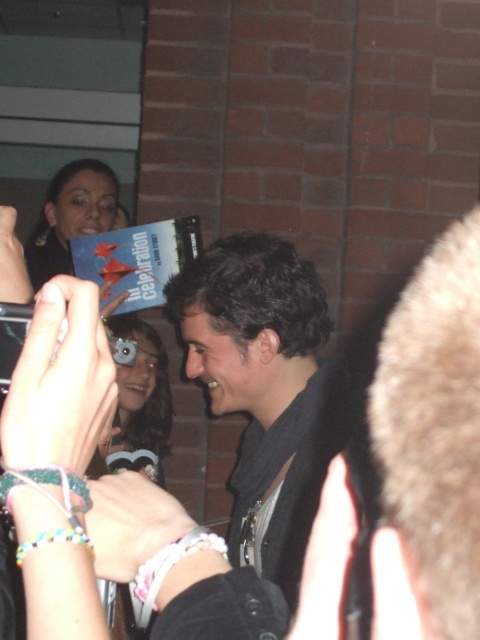
Question: Which point is farther from the camera taking this photo?

Choices:
 (A) (223, 385)
 (B) (82, 163)
 (C) (136, 353)

Answer: (B)

Question: Is matte black book at upper left positioned in front of matte black camera at center?

Choices:
 (A) yes
 (B) no

Answer: (B)

Question: Is matte black book at upper left further to camera compared to matte black camera at center?

Choices:
 (A) yes
 (B) no

Answer: (A)

Question: Considering the real-world distances, which object is farthest from the matte black camera at center?

Choices:
 (A) matte black book at upper left
 (B) dark brown hair at center

Answer: (A)

Question: Does matte black book at upper left appear on the right side of matte black camera at center?

Choices:
 (A) no
 (B) yes

Answer: (A)

Question: Which point is farther to the camera?

Choices:
 (A) (302, 387)
 (B) (61, 256)

Answer: (B)